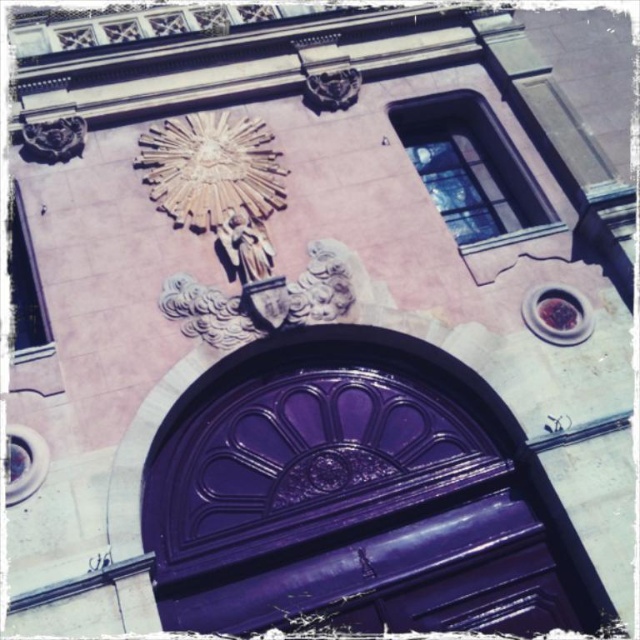
Question: Is glossy purple door at center to the right of gold metallic clock at upper center from the viewer's perspective?

Choices:
 (A) no
 (B) yes

Answer: (B)

Question: Based on their relative distances, which object is nearer to the gold metallic clock at upper center?

Choices:
 (A) glossy purple door at center
 (B) gold metallic statue at upper center

Answer: (B)

Question: Which of the following is the farthest from the observer?

Choices:
 (A) glossy purple door at center
 (B) gold metallic clock at upper center

Answer: (B)

Question: Which object is positioned closest to the gold metallic statue at upper center?

Choices:
 (A) white stone statue at center
 (B) glossy purple door at center
 (C) gold metallic clock at upper center

Answer: (A)

Question: Can you confirm if glossy purple door at center is bigger than gold metallic statue at upper center?

Choices:
 (A) yes
 (B) no

Answer: (A)

Question: Is gold metallic clock at upper center above white stone statue at center?

Choices:
 (A) no
 (B) yes

Answer: (B)